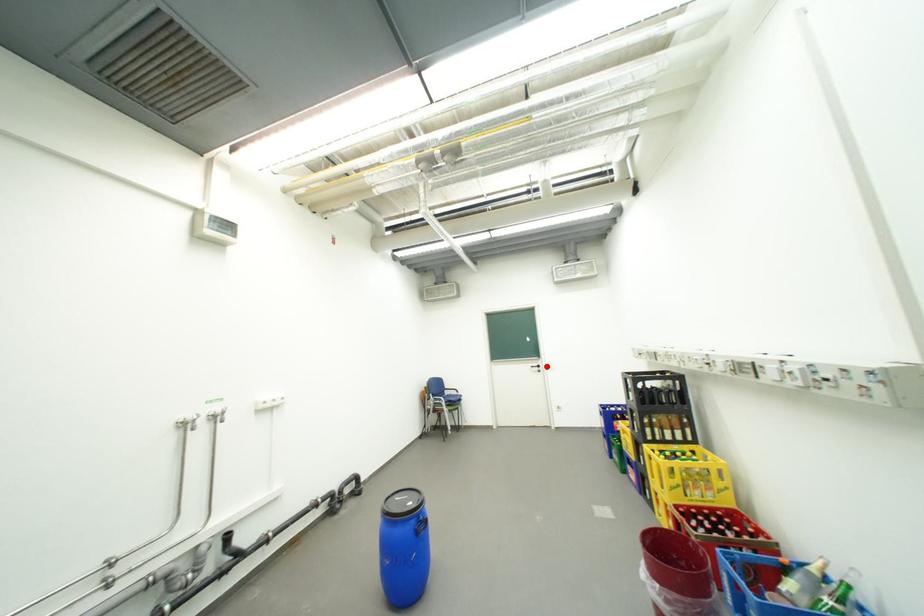
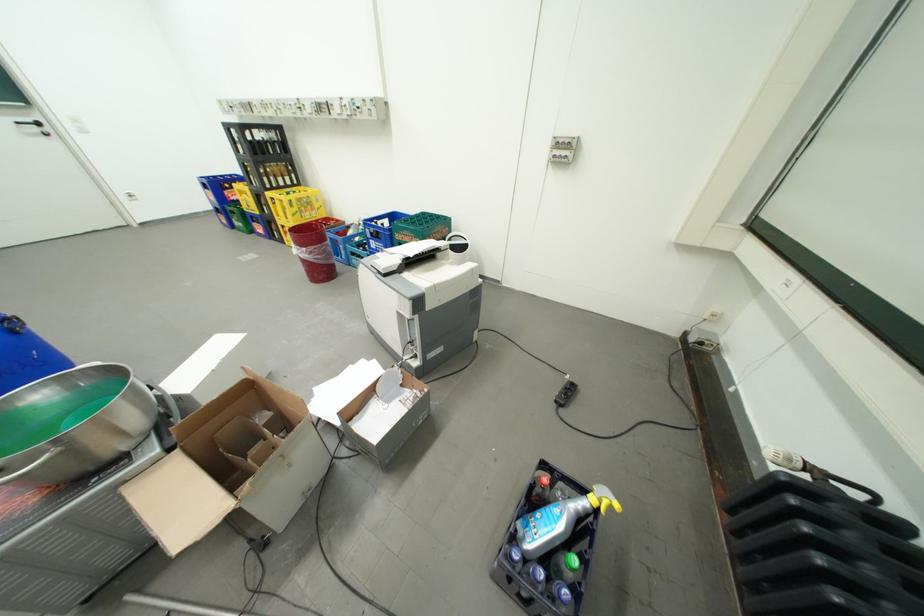
Question: I am providing you with two images of the same scene from different viewpoints. Given a red point in image1, look at the same physical point in image2. Is it:

Choices:
 (A) Closer to the viewpoint
 (B) Farther from the viewpoint

Answer: (B)